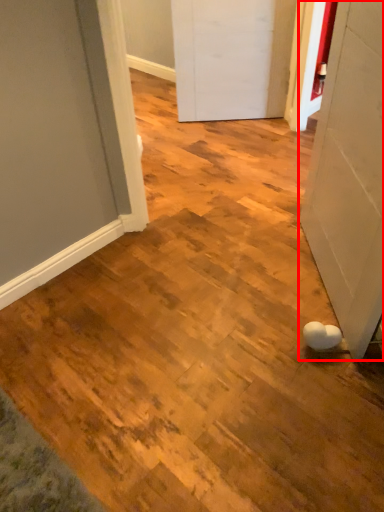
Question: From the image's perspective, where is door (annotated by the red box) located relative to door?

Choices:
 (A) below
 (B) above

Answer: (A)